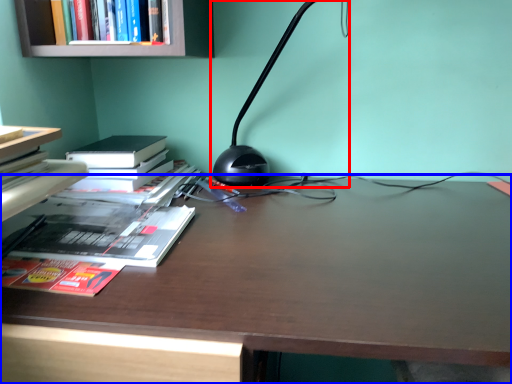
Question: Which object is further to the camera taking this photo, lamp (highlighted by a red box) or desk (highlighted by a blue box)?

Choices:
 (A) lamp
 (B) desk

Answer: (A)